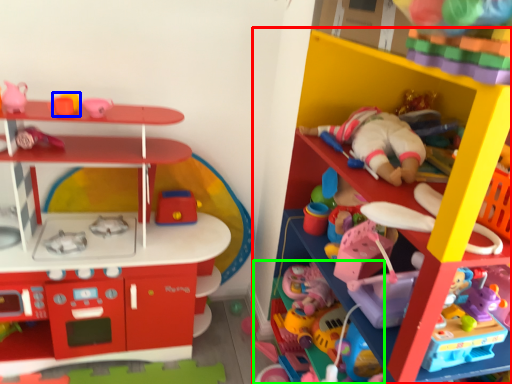
Question: Considering the real-world distances, which object is farthest from shelf (highlighted by a red box)? toy (highlighted by a blue box) or toy (highlighted by a green box)?

Choices:
 (A) toy
 (B) toy

Answer: (A)